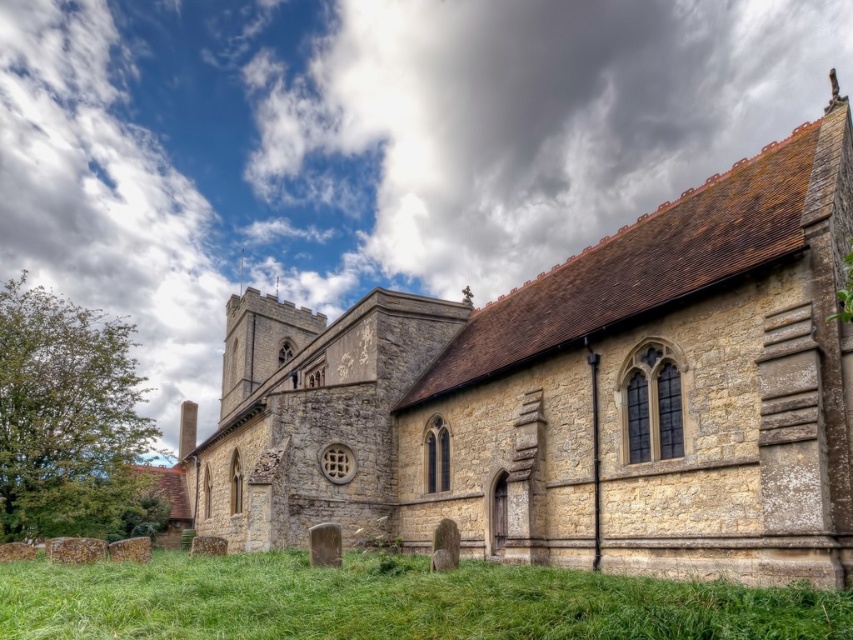
You are standing in front of the historic stone church and looking up at the cloudy sky at upper center and the green grass at lower center. Which object is positioned to the right side of the other?

The cloudy sky at upper center is positioned to the right of the green grass at lower center.